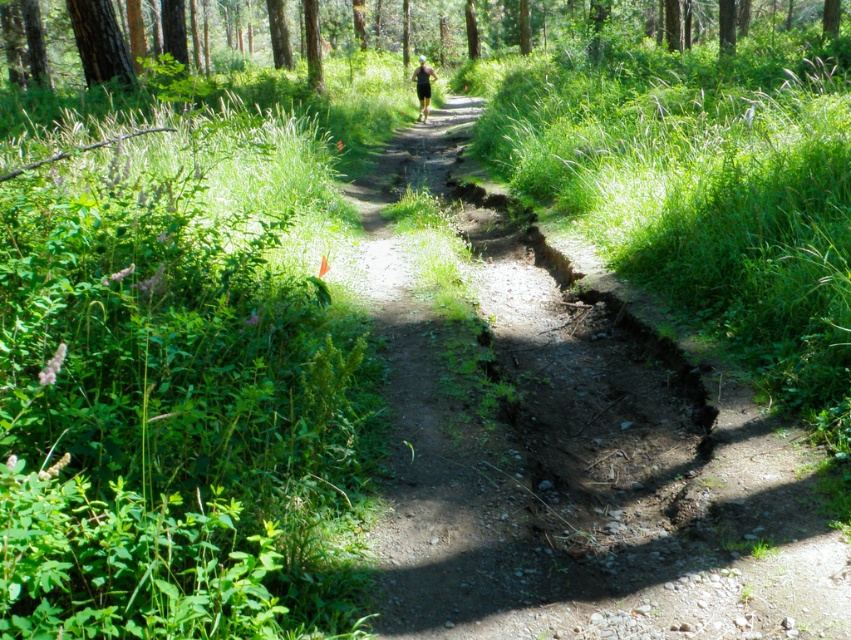
You are a hiker who wants to reach the brown textured tree at upper center from the dirt path at center. Given that your average walking pace is 3 miles per hour, approximately how many minutes will it take you to walk directly to the tree?

The distance between dirt path at center and brown textured tree at upper center is 75.62 feet. Converting this to miles, 75.62 feet is approximately 0.0143 miles. At a walking pace of 3 miles per hour, time equals distance divided by speed, so 0.0143 miles divided by 3 mph equals approximately 0.00477 hours. Converting hours to minutes by multiplying by 60 gives roughly 0.286 minutes, which is about 17 seconds. Therefore, it would take roughly 0.3 minutes or approximately 17 seconds to reach the brown tree

You are a hiker standing at the point marked as point (484, 22) on the forest trail. You want to take a photo of the brown textured tree at upper center. Which direction should you face to capture it in your camera view?

The brown textured tree at upper center is located at point (484, 22), so you should face directly towards that point to capture it in your camera view.